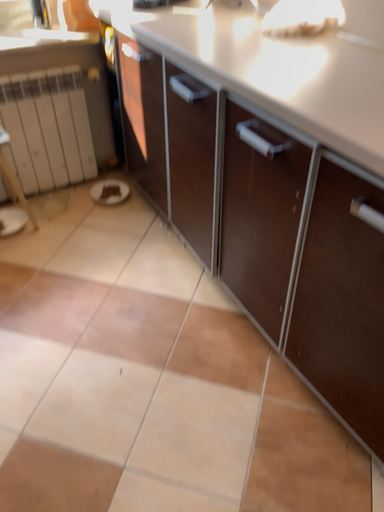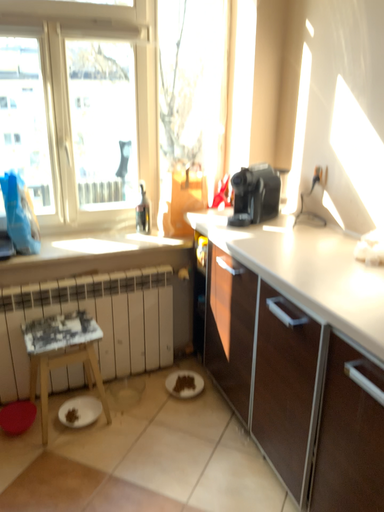
Question: Which way did the camera rotate in the video?

Choices:
 (A) rotated upward
 (B) rotated downward

Answer: (A)